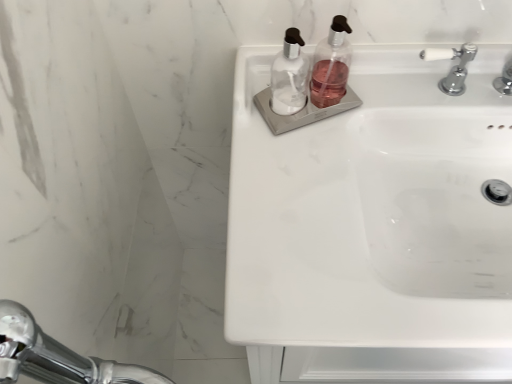
Find the location of a particular element. This screenshot has width=512, height=384. blank space to the left of white ceramic tap at upper right is located at coordinates (362, 102).